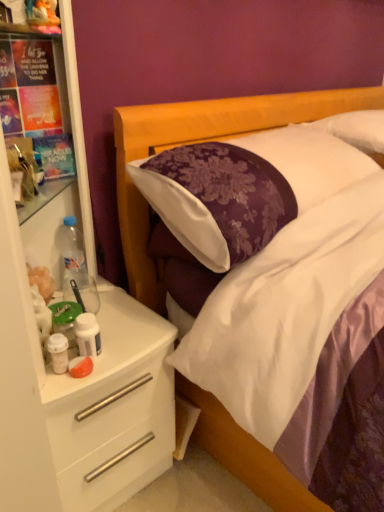
Where is `vacant area located to the right-hand side of clear plastic bottle at left, the first bottle positioned from the back`? vacant area located to the right-hand side of clear plastic bottle at left, the first bottle positioned from the back is located at coordinates coord(120,303).